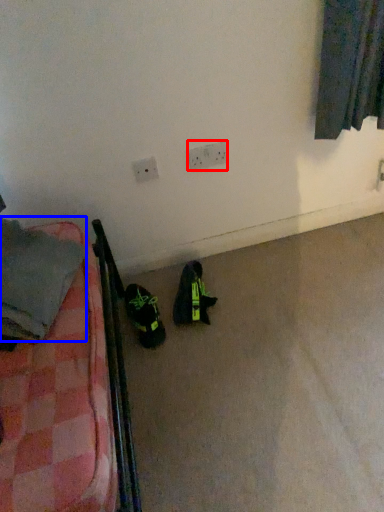
Question: Which of the following is the farthest to the observer, electric outlet (highlighted by a red box) or clothing (highlighted by a blue box)?

Choices:
 (A) electric outlet
 (B) clothing

Answer: (A)